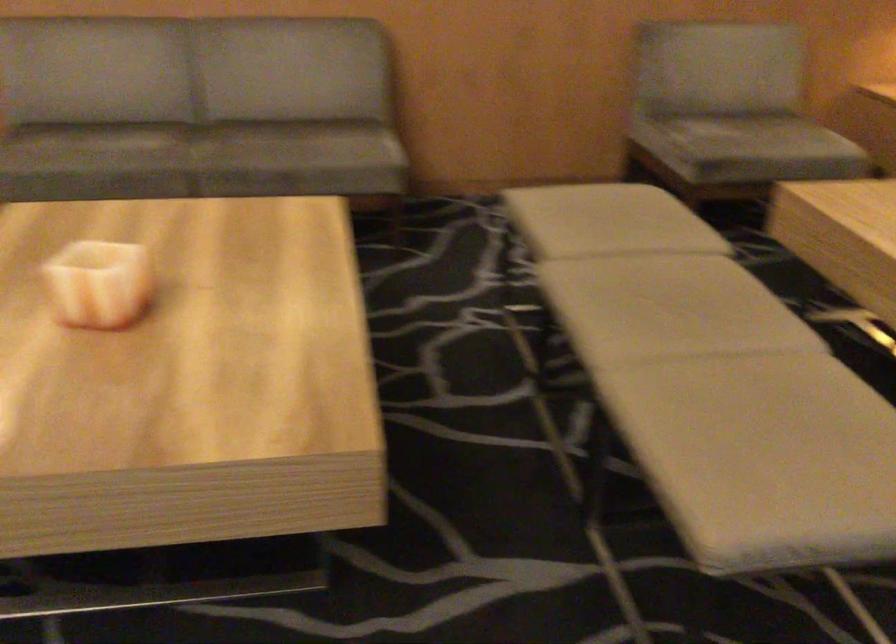
Where would you sit the sofa sitting surface? Please return your answer as a coordinate pair (x, y).

(209, 144)